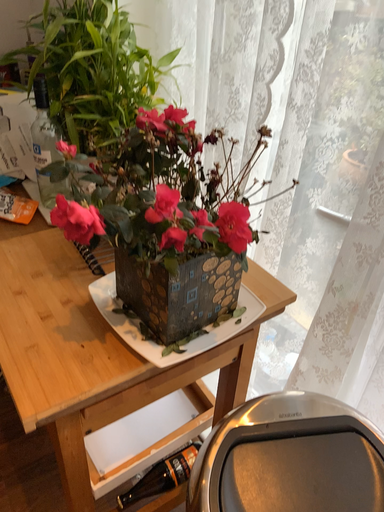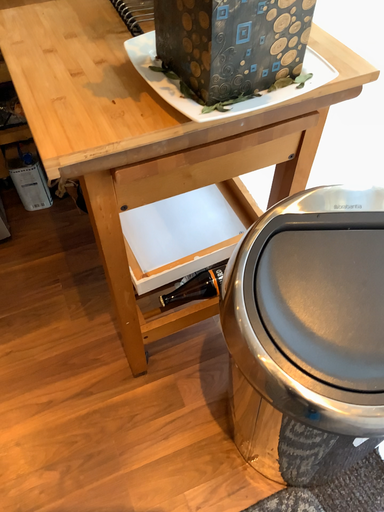
Question: How did the camera likely rotate when shooting the video?

Choices:
 (A) rotated upward
 (B) rotated downward

Answer: (B)